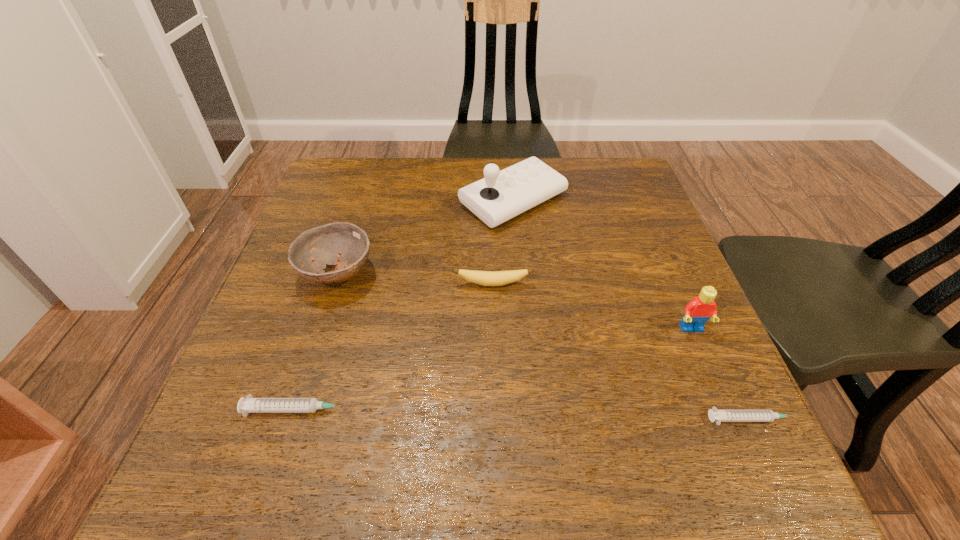
This screenshot has width=960, height=540. Identify the location of vacant point located between the third tallest object and the second shortest object. (319, 342).

Image resolution: width=960 pixels, height=540 pixels. I want to click on free spot between the left syringe and the fourth tallest object, so click(396, 347).

The height and width of the screenshot is (540, 960). I want to click on vacant area that lies between the banana and the bowl, so click(x=415, y=279).

Where is `free space between the fourth shortest object and the joystick`? The image size is (960, 540). free space between the fourth shortest object and the joystick is located at coordinates 425,237.

At what (x,y) coordinates should I click in order to perform the action: click on vacant space in between the farthest object and the banana. Please return your answer as a coordinate pair (x, y). This screenshot has width=960, height=540. Looking at the image, I should click on (503, 242).

I want to click on blank region between the third nearest object and the taller syringe, so click(x=495, y=369).

You are a GUI agent. You are given a task and a screenshot of the screen. Output one action in this format:
    pyautogui.click(x=<x>, y=<y>)
    Task: Click on the vacant area that lies between the tallest object and the fourth tallest object
    
    Given the screenshot: What is the action you would take?
    pyautogui.click(x=503, y=242)

Where is `unoccupied area between the fifth tallest object and the fifth shortest object`? unoccupied area between the fifth tallest object and the fifth shortest object is located at coordinates (495, 369).

Locate an element on the screen. vacant space that is in between the third nearest object and the right syringe is located at coordinates (723, 374).

Identify which object is located as the fifth nearest to the Lego. Please provide its 2D coordinates. Your answer should be formatted as a tuple, i.e. [(x, y)], where the tuple contains the x and y coordinates of a point satisfying the conditions above.

[(323, 244)]